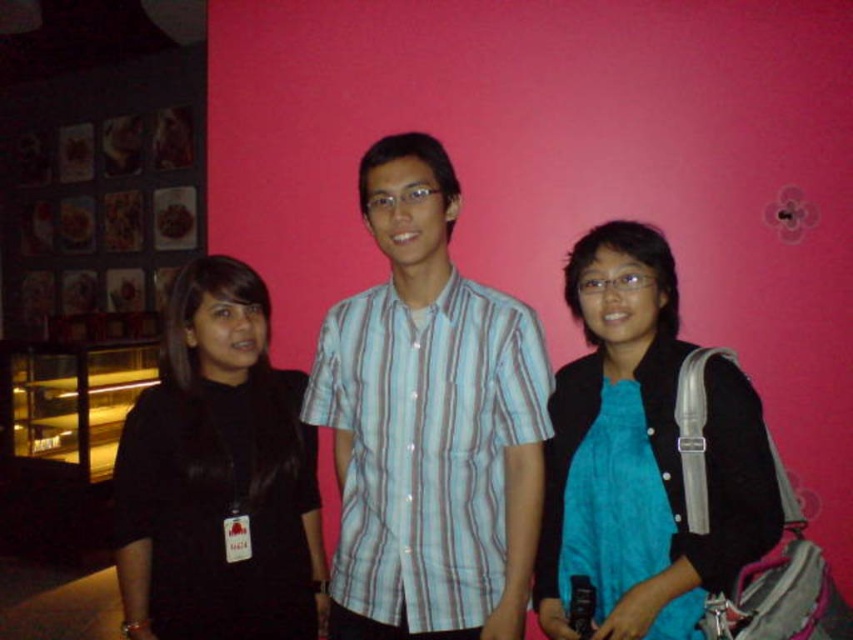
You are planning to hang a decorative banner between the light blue striped shirt at center and the black matte shirt at left. Based on their positions, will the banner need to be longer than 1 meter to span between them?

The light blue striped shirt at center might be wider than black matte shirt at left, but without specific distance information between them, it is impossible to determine if the banner needs to be longer than 1 meter.

You are a photographer setting up for a group photo. You need to ensure that the light blue striped shirt at center and the blue fabric scarf at center are both visible in the frame. Based on their positions, which one should you focus on first to make sure both are in focus?

The light blue striped shirt at center is above the blue fabric scarf at center, so focusing on the light blue striped shirt at center first will ensure both are in focus since it is higher up.